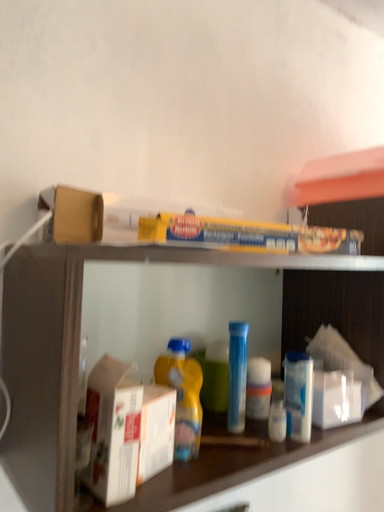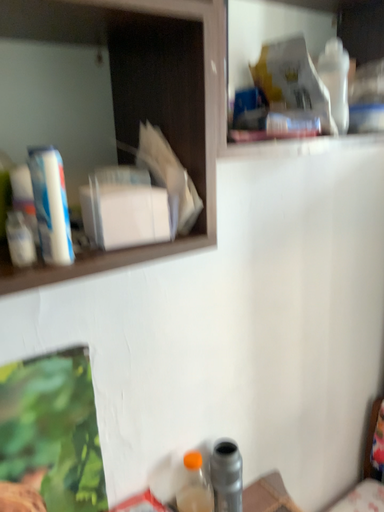
Question: Which way did the camera rotate in the video?

Choices:
 (A) rotated downward
 (B) rotated upward

Answer: (A)